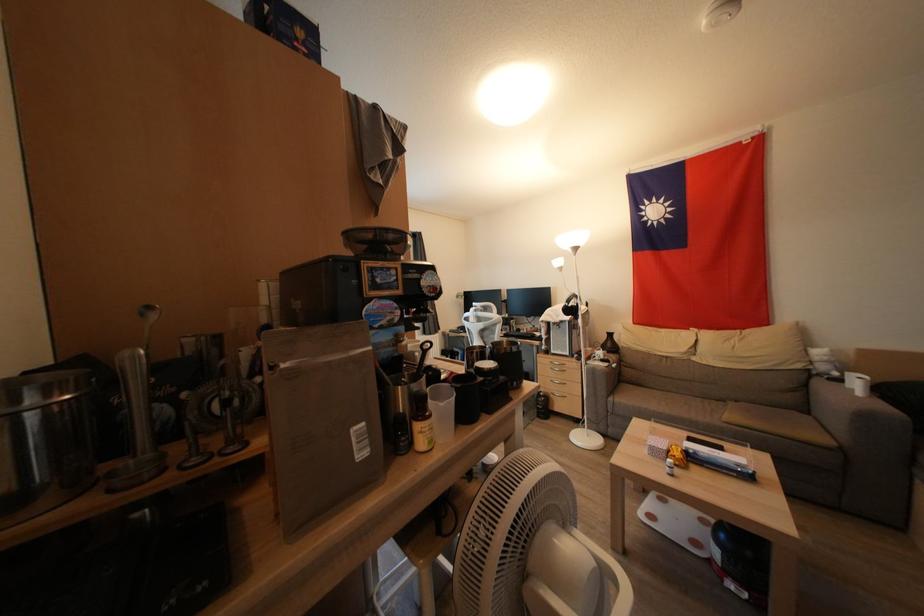
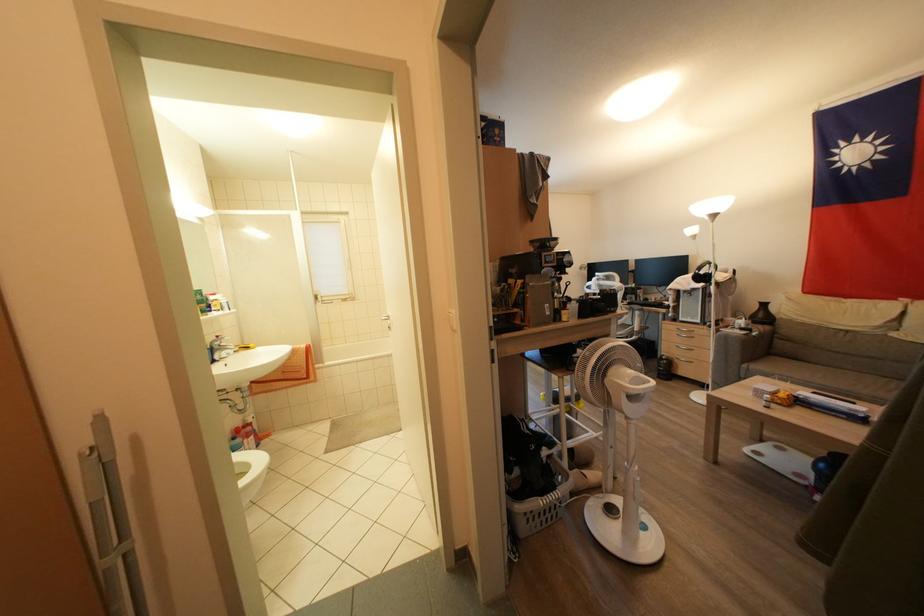
Find the pixel in the second image that matches point (744, 469) in the first image.

(858, 415)